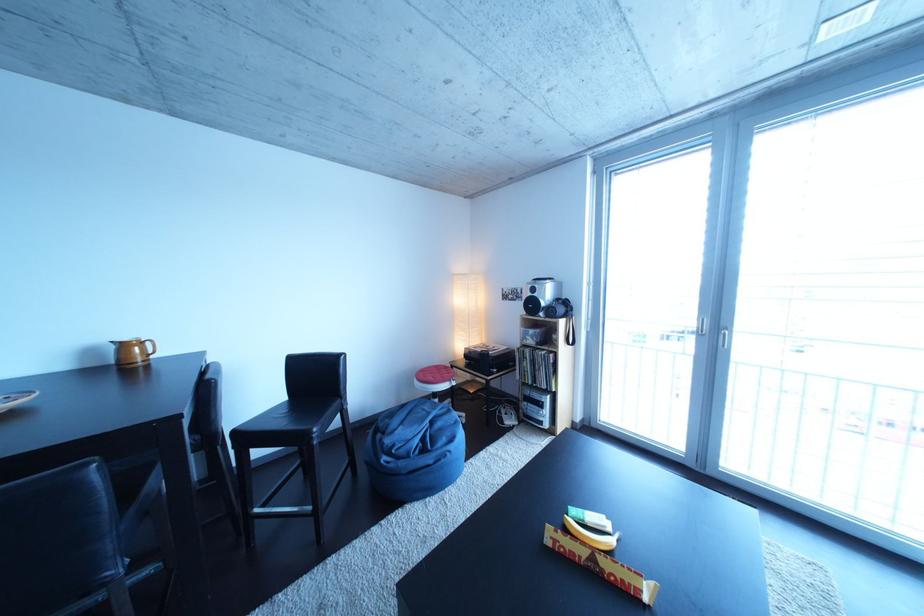
The image size is (924, 616). Find the location of `brown pitcher handle`. brown pitcher handle is located at coordinates (132, 352).